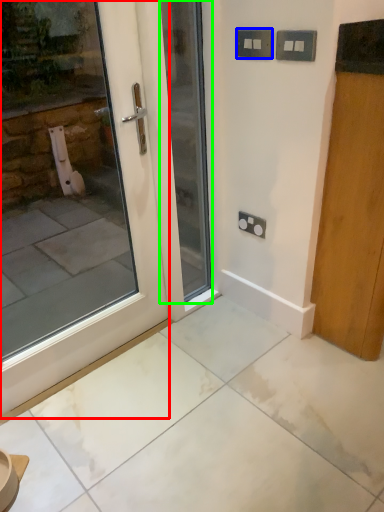
Question: Which is nearer to the door (highlighted by a red box)? electric outlet (highlighted by a blue box) or door (highlighted by a green box).

Choices:
 (A) electric outlet
 (B) door

Answer: (B)